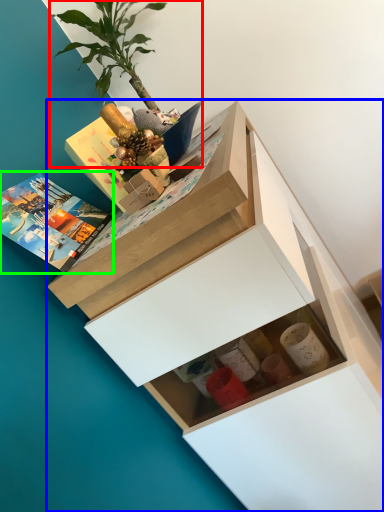
Question: Which object is positioned farthest from houseplant (highlighted by a red box)? Select from chest of drawers (highlighted by a blue box) and book (highlighted by a green box).

Choices:
 (A) chest of drawers
 (B) book

Answer: (A)